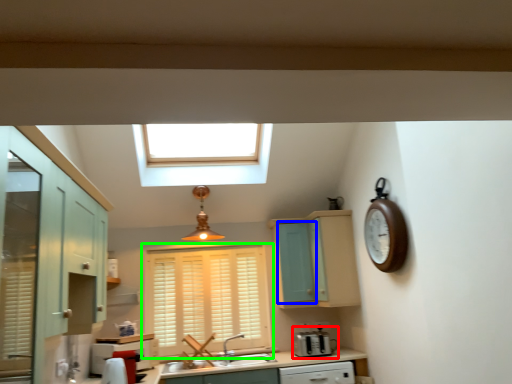
Question: Based on their relative distances, which object is nearer to appliance (highlighted by a red box)? Choose from screen door (highlighted by a blue box) and window (highlighted by a green box).

Choices:
 (A) screen door
 (B) window

Answer: (A)